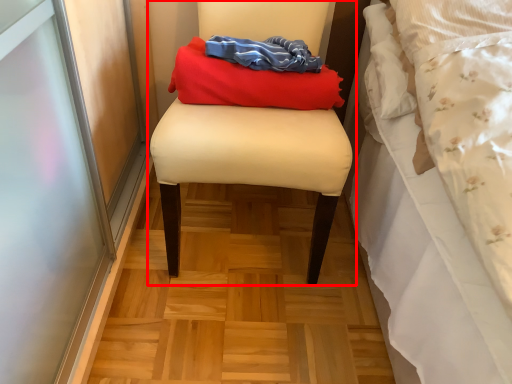
Question: In this image, where is furniture (annotated by the red box) located relative to laundry?

Choices:
 (A) right
 (B) left

Answer: (B)